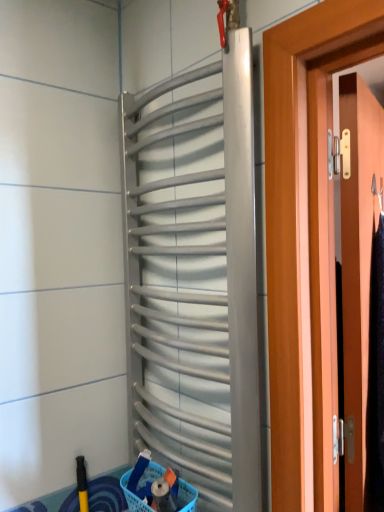
What do you see at coordinates (195, 277) in the screenshot? Image resolution: width=384 pixels, height=512 pixels. I see `silver metallic radiator at center` at bounding box center [195, 277].

What is the approximate width of wooden door at right?

wooden door at right is 4.59 inches wide.

Identify the location of yellow rubber brush at lower left. (82, 484).

What do you see at coordinates (187, 496) in the screenshot?
I see `blue plastic basket at lower center` at bounding box center [187, 496].

Identify the location of silver metallic radiator at center. (195, 277).

From the picture: Who is taller, yellow rubber brush at lower left or silver metallic radiator at center?

silver metallic radiator at center.

Consider the image. Is silver metallic radiator at center at the back of yellow rubber brush at lower left?

No.

Is there a large distance between yellow rubber brush at lower left and silver metallic radiator at center?

No, yellow rubber brush at lower left is in close proximity to silver metallic radiator at center.

Does yellow rubber brush at lower left have a smaller size compared to silver metallic radiator at center?

Correct, yellow rubber brush at lower left occupies less space than silver metallic radiator at center.

Can you confirm if wooden door at right is bigger than yellow rubber brush at lower left?

Yes, wooden door at right is bigger than yellow rubber brush at lower left.

You are a GUI agent. You are given a task and a screenshot of the screen. Output one action in this format:
    pyautogui.click(x=<x>, y=<y>)
    Task: Click on the brush behind the wooden door at right
    This screenshot has height=512, width=384.
    Given the screenshot: What is the action you would take?
    pyautogui.click(x=82, y=484)

From the image's perspective, which one is positioned higher, wooden door at right or yellow rubber brush at lower left?

wooden door at right, from the image's perspective.

Is wooden door at right looking in the opposite direction of yellow rubber brush at lower left?

Yes, wooden door at right is positioned with its back facing yellow rubber brush at lower left.

From the image's perspective, is wooden door at right located beneath silver metallic radiator at center?

Yes.

Would you say wooden door at right is a long distance from silver metallic radiator at center?

No, wooden door at right is not far from silver metallic radiator at center.

Which is more to the left, wooden door at right or silver metallic radiator at center?

silver metallic radiator at center.

Who is more distant, wooden door at right or silver metallic radiator at center?

Positioned behind is wooden door at right.

In the scene shown: Who is smaller, silver metallic radiator at center or wooden door at right?

silver metallic radiator at center.

In the scene shown: From the image's perspective, which one is positioned higher, silver metallic radiator at center or wooden door at right?

silver metallic radiator at center.

Between silver metallic radiator at center and wooden door at right, which one is positioned in front?

silver metallic radiator at center is more forward.

Is silver metallic radiator at center looking in the opposite direction of wooden door at right?

That's right, silver metallic radiator at center is facing away from wooden door at right.

Is yellow rubber brush at lower left not within blue plastic basket at lower center?

That's correct, yellow rubber brush at lower left is outside of blue plastic basket at lower center.

Is yellow rubber brush at lower left to the left or to the right of blue plastic basket at lower center in the image?

Clearly, yellow rubber brush at lower left is on the left of blue plastic basket at lower center in the image.

Looking at their sizes, would you say yellow rubber brush at lower left is wider or thinner than blue plastic basket at lower center?

Clearly, yellow rubber brush at lower left has less width compared to blue plastic basket at lower center.

Is wooden door at right inside or outside of blue plastic basket at lower center?

wooden door at right is not inside blue plastic basket at lower center, it's outside.

From the picture: How many degrees apart are the facing directions of wooden door at right and blue plastic basket at lower center?

wooden door at right and blue plastic basket at lower center are facing 108 degrees away from each other.

In terms of height, does wooden door at right look taller or shorter compared to blue plastic basket at lower center?

Considering their sizes, wooden door at right has more height than blue plastic basket at lower center.

From a real-world perspective, is yellow rubber brush at lower left physically below wooden door at right?

Yes.

In the image, is yellow rubber brush at lower left on the left side or the right side of wooden door at right?

yellow rubber brush at lower left is positioned on wooden door at right's left side.

Between yellow rubber brush at lower left and wooden door at right, which one has larger size?

wooden door at right is bigger.

Image resolution: width=384 pixels, height=512 pixels. I want to click on shutter that is above the yellow rubber brush at lower left (from the image's perspective), so click(195, 277).

The width and height of the screenshot is (384, 512). Identify the location of brush directly beneath the wooden door at right (from a real-world perspective). (82, 484).

Looking at the image, which one is located further to blue plastic basket at lower center, yellow rubber brush at lower left or silver metallic radiator at center?

silver metallic radiator at center is positioned further to the anchor blue plastic basket at lower center.

From the image, which object appears to be nearer to wooden door at right, blue plastic basket at lower center or silver metallic radiator at center?

silver metallic radiator at center is closer to wooden door at right.

Estimate the real-world distances between objects in this image. Which object is closer to blue plastic basket at lower center, yellow rubber brush at lower left or wooden door at right?

The object closer to blue plastic basket at lower center is yellow rubber brush at lower left.

Which object lies further to the anchor point yellow rubber brush at lower left, wooden door at right or silver metallic radiator at center?

wooden door at right.

From the image, which object appears to be nearer to silver metallic radiator at center, wooden door at right or yellow rubber brush at lower left?

The object closer to silver metallic radiator at center is wooden door at right.

Based on their spatial positions, is silver metallic radiator at center or wooden door at right further from blue plastic basket at lower center?

wooden door at right.

Considering their positions, is silver metallic radiator at center positioned closer to yellow rubber brush at lower left than wooden door at right?

silver metallic radiator at center is closer to yellow rubber brush at lower left.

Looking at the image, which one is located further to blue plastic basket at lower center, wooden door at right or silver metallic radiator at center?

wooden door at right lies further to blue plastic basket at lower center than the other object.

What are the coordinates of `basket between silver metallic radiator at center and yellow rubber brush at lower left in the up-down direction` in the screenshot? It's located at tap(187, 496).

Where is `shutter between yellow rubber brush at lower left and wooden door at right in the horizontal direction`? shutter between yellow rubber brush at lower left and wooden door at right in the horizontal direction is located at coordinates (195, 277).

Where is `shutter between blue plastic basket at lower center and wooden door at right in the horizontal direction`? shutter between blue plastic basket at lower center and wooden door at right in the horizontal direction is located at coordinates (195, 277).

Find the location of a particular element. This screenshot has width=384, height=512. basket between yellow rubber brush at lower left and wooden door at right in the horizontal direction is located at coordinates (187, 496).